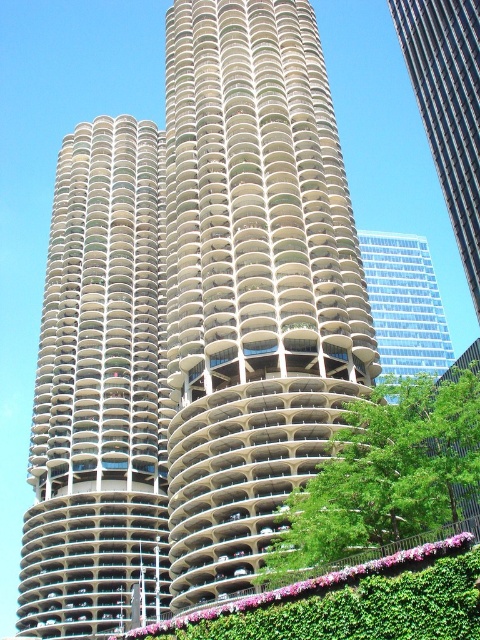
You are standing in front of the beige concrete tower at center and want to walk to the green leafy tree at lower right. Which direction should you move to reach it?

The beige concrete tower at center is positioned on the left side of green leafy tree at lower right, so you should move to the right to reach the green leafy tree at lower right.

You are standing in front of the beige concrete tower at center and want to walk to the green leafy tree at lower right. Which direction should you move to get closer to the tree?

The beige concrete tower at center is closer to you than the green leafy tree at lower right. To get closer to the tree, you should move forward away from the beige concrete tower at center since the tree is further away.

You are an architect evaluating the design of two skyscrapers in the image. The glassy reflective skyscraper at upper right and the transparent glass skyscraper at upper right. Based on their sizes, which one would require less material for constructing the exterior walls?

The glassy reflective skyscraper at upper right is smaller than the transparent glass skyscraper at upper right, so it would require less material for constructing the exterior walls.